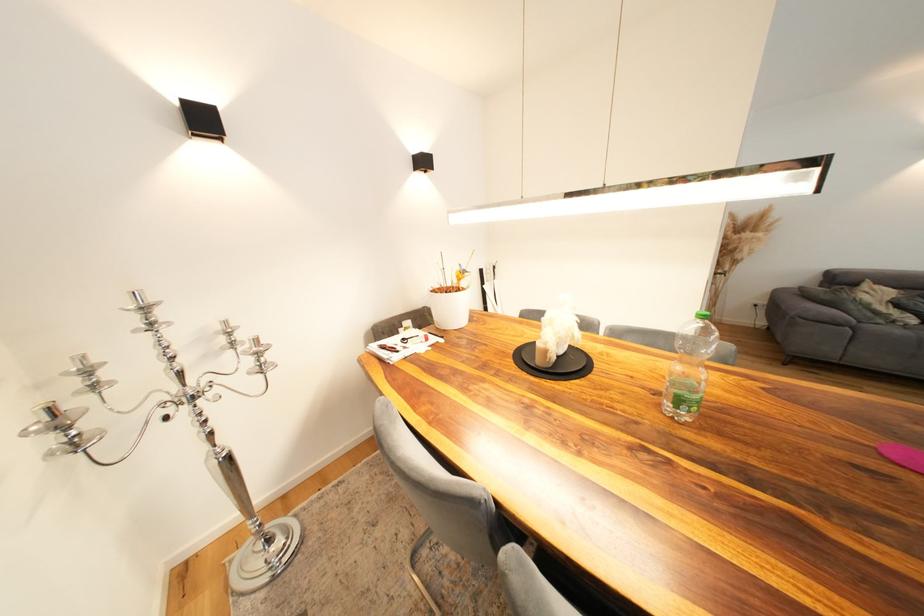
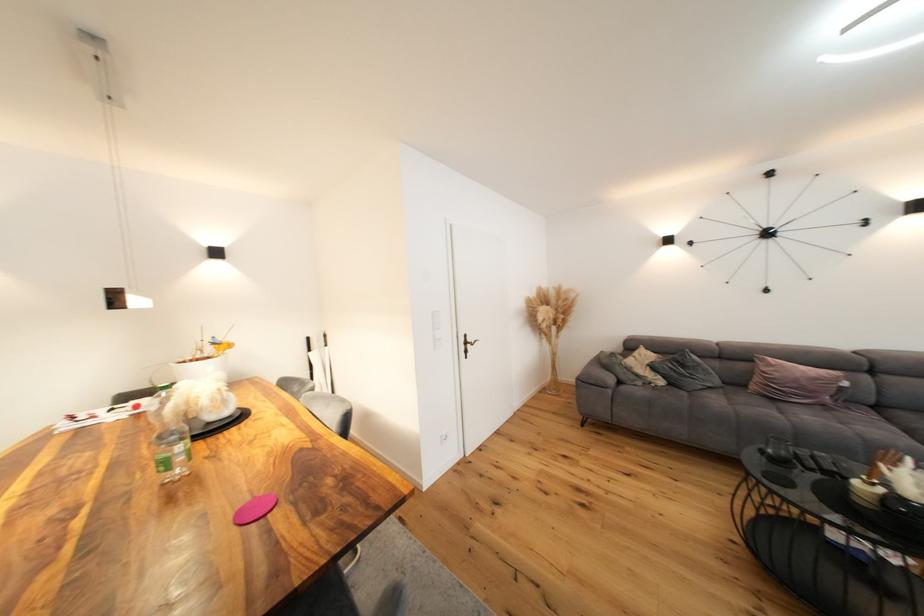
Locate, in the second image, the point that corresponds to pixel 873 308 in the first image.

(637, 371)